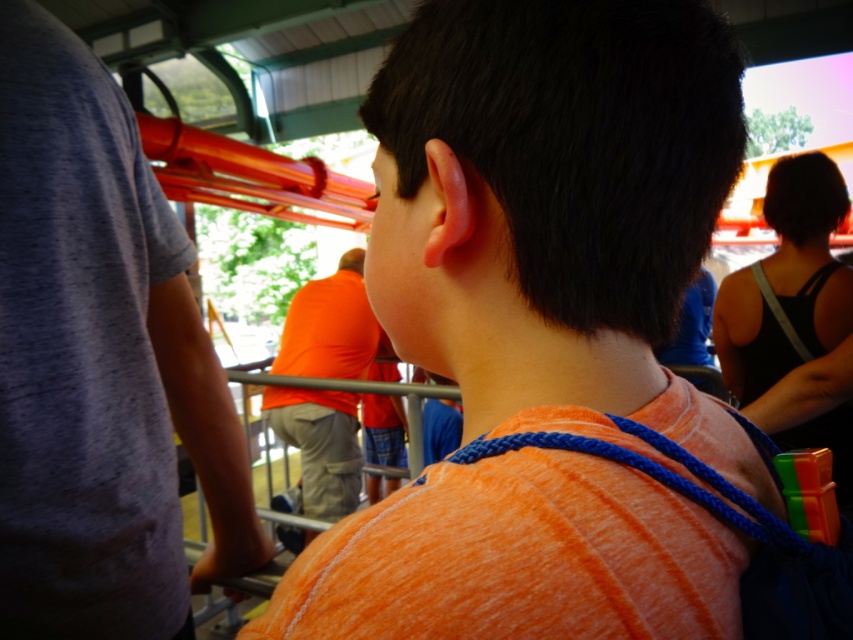
Question: Can you confirm if gray cotton t-shirt at upper left is wider than orange cotton shirt at center?

Choices:
 (A) yes
 (B) no

Answer: (B)

Question: Can you confirm if orange fabric shirt at center is wider than gray cotton t-shirt at upper left?

Choices:
 (A) yes
 (B) no

Answer: (A)

Question: Which of the following is the closest to the observer?

Choices:
 (A) orange fabric shirt at center
 (B) gray cotton t-shirt at upper left

Answer: (A)

Question: Which point is closer to the camera?

Choices:
 (A) gray cotton t-shirt at upper left
 (B) orange fabric shirt at center
 (C) orange cotton shirt at center

Answer: (B)

Question: Which point appears farthest from the camera in this image?

Choices:
 (A) (334, 346)
 (B) (33, 554)

Answer: (A)

Question: Is orange fabric shirt at center above gray cotton t-shirt at upper left?

Choices:
 (A) no
 (B) yes

Answer: (B)